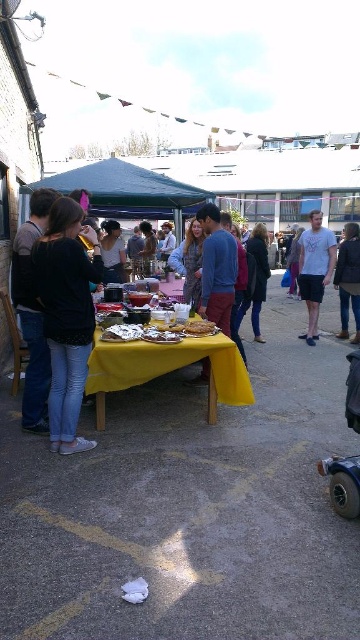
Question: Observing the image, what is the correct spatial positioning of yellow fabric table at center in reference to dark blue jeans at left?

Choices:
 (A) right
 (B) left

Answer: (A)

Question: Which point is farther to the camera?

Choices:
 (A) dark blue jeans at left
 (B) white cotton t-shirt at right
 (C) metallic silver baby carriage at lower right

Answer: (B)

Question: Among these points, which one is nearest to the camera?

Choices:
 (A) (320, 468)
 (B) (146, 337)
 (C) (331, 243)

Answer: (A)

Question: Which point is closer to the camera?

Choices:
 (A) (29, 262)
 (B) (345, 268)
 (C) (141, 337)
 (D) (209, 275)

Answer: (A)

Question: Does white cotton t-shirt at right come in front of matte brown bread at center?

Choices:
 (A) no
 (B) yes

Answer: (A)

Question: From the image, what is the correct spatial relationship of yellow fabric table at center in relation to metallic silver baby carriage at lower right?

Choices:
 (A) above
 (B) below

Answer: (A)